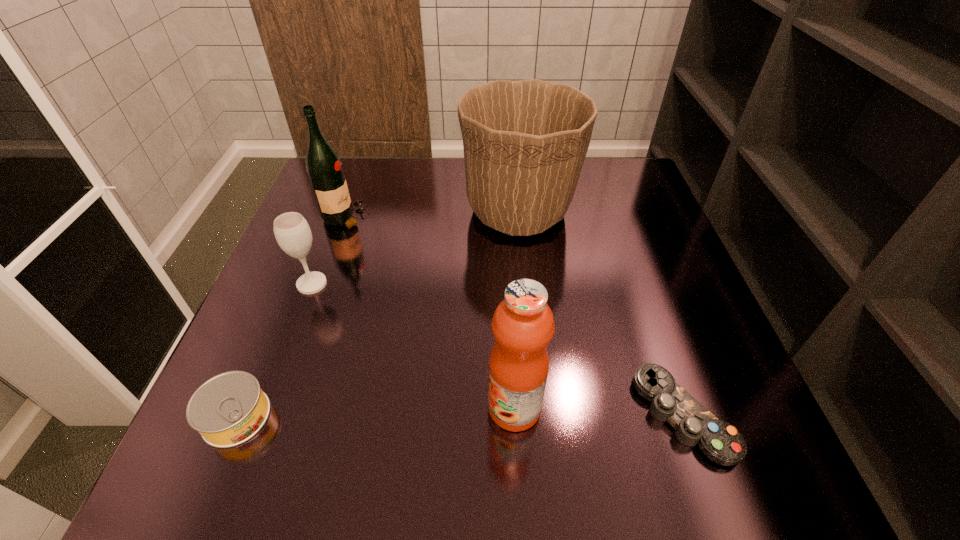
Locate an element on the screen. This screenshot has width=960, height=540. the fourth closest object to the wineglass is located at coordinates (523, 325).

Where is `free location that satisfies the following two spatial constraints: 1. on the back side of the wine bottle; 2. on the left side of the fifth tallest object`? The height and width of the screenshot is (540, 960). free location that satisfies the following two spatial constraints: 1. on the back side of the wine bottle; 2. on the left side of the fifth tallest object is located at coordinates (320, 218).

The height and width of the screenshot is (540, 960). I want to click on vacant point that satisfies the following two spatial constraints: 1. on the front side of the flowerpot; 2. on the right side of the control, so pos(540,415).

You are a GUI agent. You are given a task and a screenshot of the screen. Output one action in this format:
    pyautogui.click(x=<x>, y=<y>)
    Task: Click on the free region that satisfies the following two spatial constraints: 1. on the front side of the wine bottle; 2. on the left side of the control
    The width and height of the screenshot is (960, 540).
    Given the screenshot: What is the action you would take?
    pyautogui.click(x=275, y=415)

Identify the location of vacant space that satisfies the following two spatial constraints: 1. on the back side of the flowerpot; 2. on the left side of the wineglass. (339, 211).

Where is `free space that satisfies the following two spatial constraints: 1. on the front side of the flowerpot; 2. on the front label of the fruit juice`? The width and height of the screenshot is (960, 540). free space that satisfies the following two spatial constraints: 1. on the front side of the flowerpot; 2. on the front label of the fruit juice is located at coordinates (539, 408).